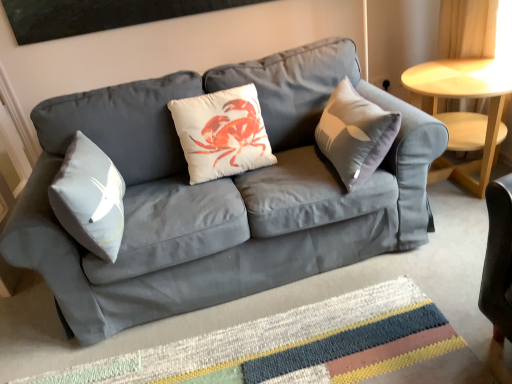
The image size is (512, 384). In order to click on free space above multicolored woven mat at center (from a real-world perspective) in this screenshot , I will do `click(282, 350)`.